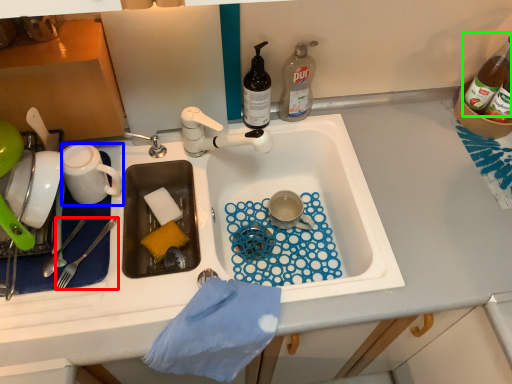
Question: Estimate the real-world distances between objects in this image. Which object is farther from fork (highlighted by a red box), coffee cup (highlighted by a blue box) or bottle (highlighted by a green box)?

Choices:
 (A) coffee cup
 (B) bottle

Answer: (B)